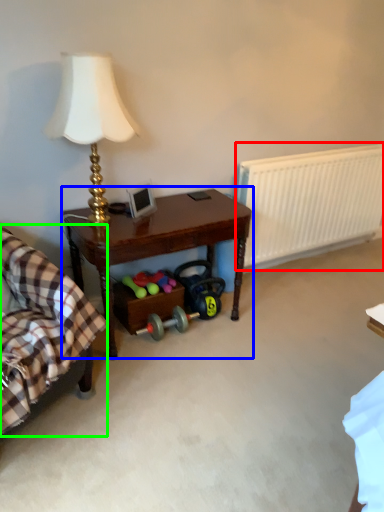
Question: Which is farther away from radiator (highlighted by a red box)? table (highlighted by a blue box) or rocking chair (highlighted by a green box)?

Choices:
 (A) table
 (B) rocking chair

Answer: (B)